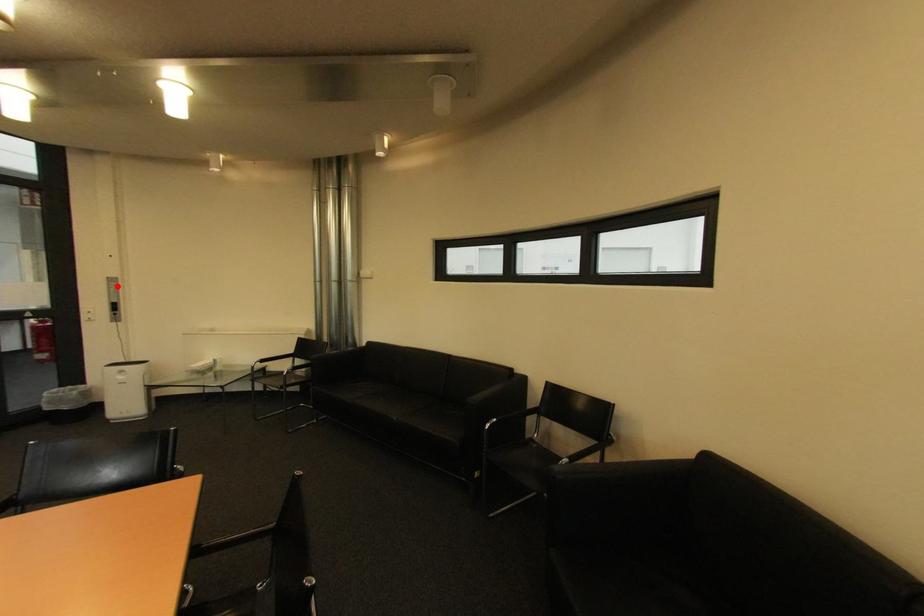
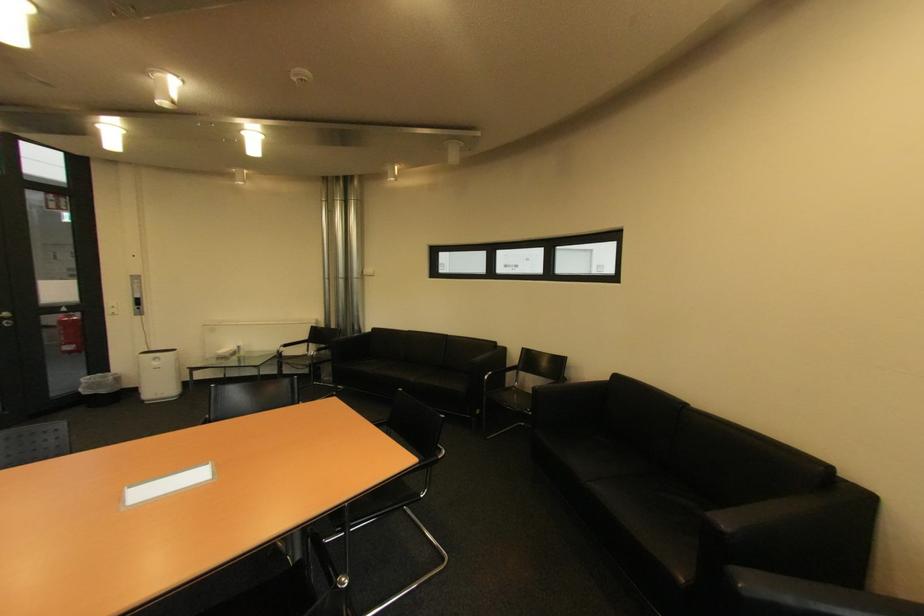
Find the pixel in the second image that matches the highlighted location in the first image.

(140, 283)